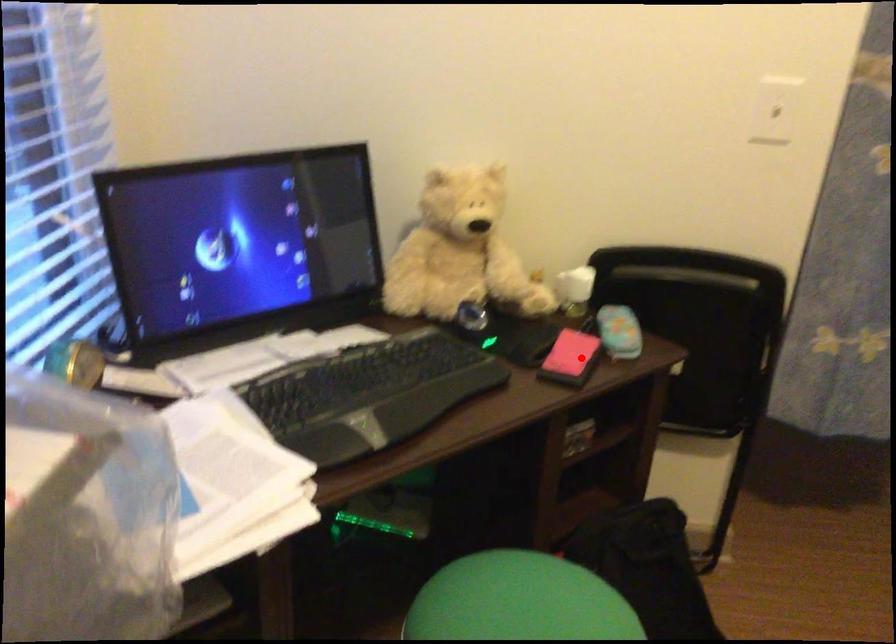
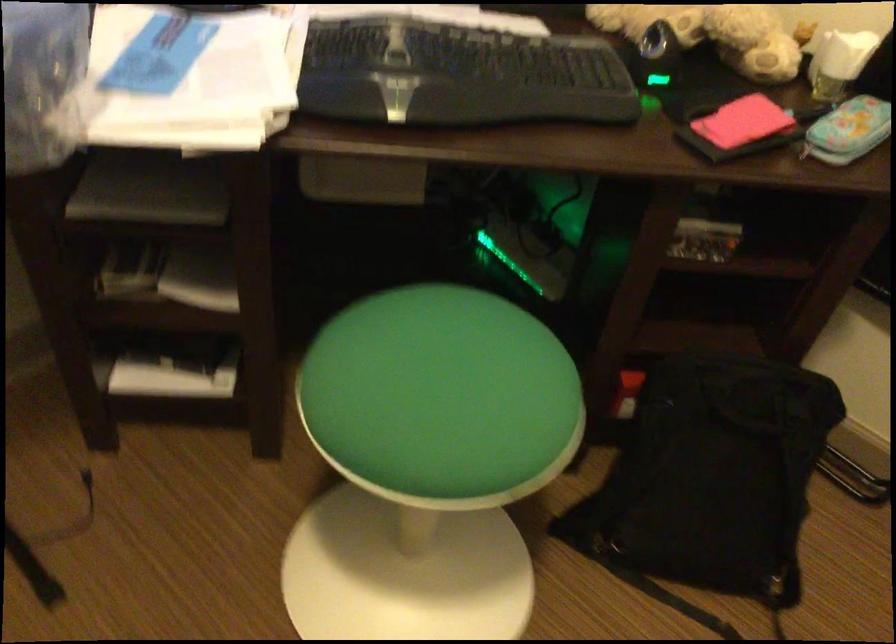
Question: I am providing you with two images of the same scene from different viewpoints. A red point is shown in image1. For the corresponding object point in image2, is it positioned nearer or farther from the camera?

Choices:
 (A) Nearer
 (B) Farther

Answer: (A)